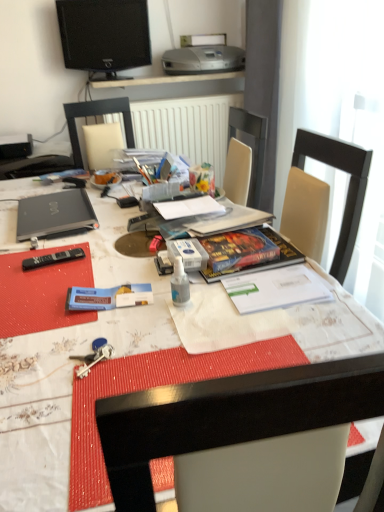
Question: From a real-world perspective, is black matte laptop at left on silver metallic printer at upper center?

Choices:
 (A) no
 (B) yes

Answer: (A)

Question: Is black matte laptop at left completely or partially outside of silver metallic printer at upper center?

Choices:
 (A) no
 (B) yes

Answer: (B)

Question: Is black matte laptop at left wider than silver metallic printer at upper center?

Choices:
 (A) yes
 (B) no

Answer: (B)

Question: Is black matte laptop at left facing away from silver metallic printer at upper center?

Choices:
 (A) yes
 (B) no

Answer: (B)

Question: Is black matte laptop at left to the left of silver metallic printer at upper center from the viewer's perspective?

Choices:
 (A) yes
 (B) no

Answer: (A)

Question: Is silver metallic printer at upper center inside the boundaries of black plastic remote control at lower left, or outside?

Choices:
 (A) inside
 (B) outside

Answer: (B)

Question: From the image's perspective, relative to black plastic remote control at lower left, is silver metallic printer at upper center above or below?

Choices:
 (A) below
 (B) above

Answer: (B)

Question: Considering the relative positions of silver metallic printer at upper center and black plastic remote control at lower left in the image provided, is silver metallic printer at upper center to the left or to the right of black plastic remote control at lower left?

Choices:
 (A) left
 (B) right

Answer: (B)

Question: Considering the positions of silver metallic printer at upper center and black plastic remote control at lower left in the image, is silver metallic printer at upper center taller or shorter than black plastic remote control at lower left?

Choices:
 (A) tall
 (B) short

Answer: (A)

Question: From a real-world perspective, is black matte laptop at left positioned above or below transparent plastic spray bottle at center?

Choices:
 (A) below
 (B) above

Answer: (A)

Question: From their relative heights in the image, would you say black matte laptop at left is taller or shorter than transparent plastic spray bottle at center?

Choices:
 (A) tall
 (B) short

Answer: (B)

Question: In the image, is black matte laptop at left positioned in front of or behind transparent plastic spray bottle at center?

Choices:
 (A) front
 (B) behind

Answer: (B)

Question: Choose the correct answer: Is black matte laptop at left inside transparent plastic spray bottle at center or outside it?

Choices:
 (A) outside
 (B) inside

Answer: (A)

Question: From their relative heights in the image, would you say black glossy television at upper center is taller or shorter than black matte laptop at left?

Choices:
 (A) short
 (B) tall

Answer: (B)

Question: Does point (82, 39) appear closer or farther from the camera than point (94, 219)?

Choices:
 (A) farther
 (B) closer

Answer: (A)